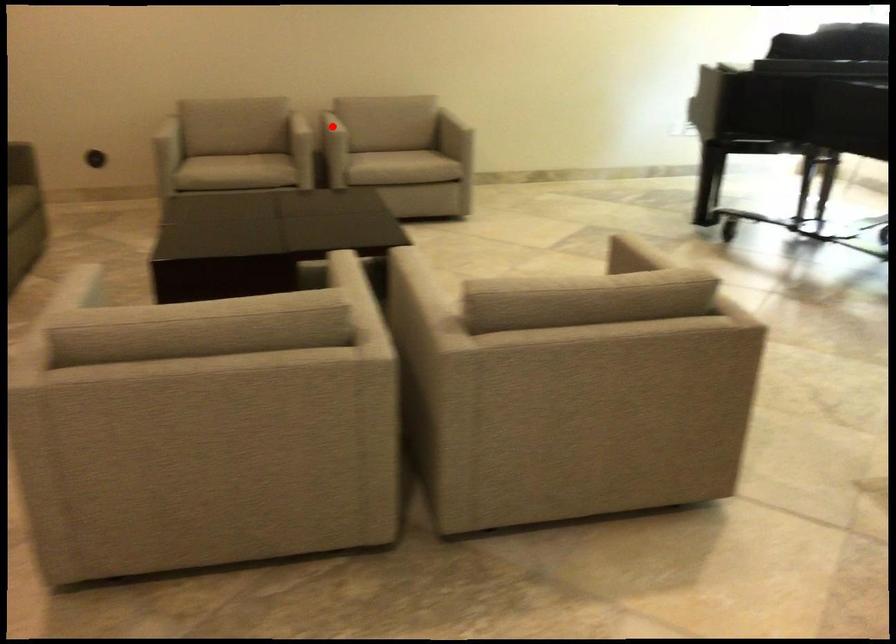
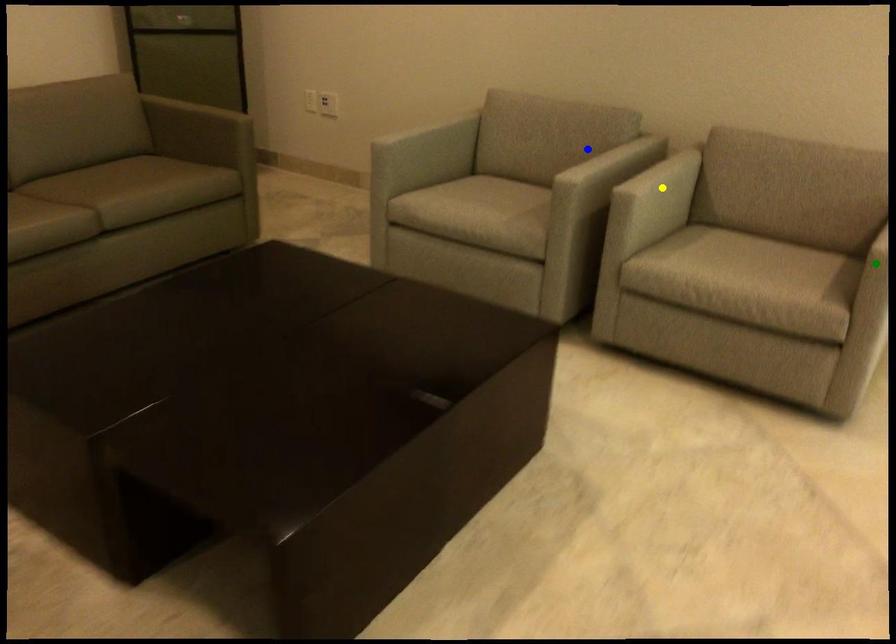
Question: I am providing you with two images of the same scene from different viewpoints. A red point is marked on the first image. You are given multiple points on the second image. Which mark in image 2 goes with the point in image 1?

Choices:
 (A) blue point
 (B) yellow point
 (C) green point

Answer: (B)